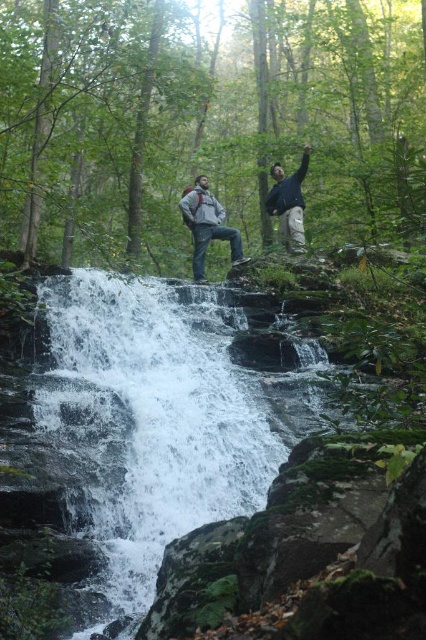
Between white frothy water at center and gray matte jacket at center, which one is positioned lower?

white frothy water at center is below.

Does white frothy water at center have a larger size compared to gray matte jacket at center?

Yes.

Which is in front, point (175, 488) or point (198, 260)?

Point (175, 488)

Image resolution: width=426 pixels, height=640 pixels. I want to click on white frothy water at center, so click(146, 424).

Who is higher up, green matte forest at upper center or dark blue jacket at upper center?

Positioned higher is green matte forest at upper center.

Identify the location of green matte forest at upper center. The image size is (426, 640). (207, 122).

Is white frothy water at center bigger than dark blue jacket at upper center?

Yes.

Can you confirm if white frothy water at center is positioned to the left of dark blue jacket at upper center?

Correct, you'll find white frothy water at center to the left of dark blue jacket at upper center.

Which is behind, point (210, 499) or point (290, 182)?

Point (290, 182)

The width and height of the screenshot is (426, 640). In order to click on white frothy water at center in this screenshot , I will do coord(146,424).